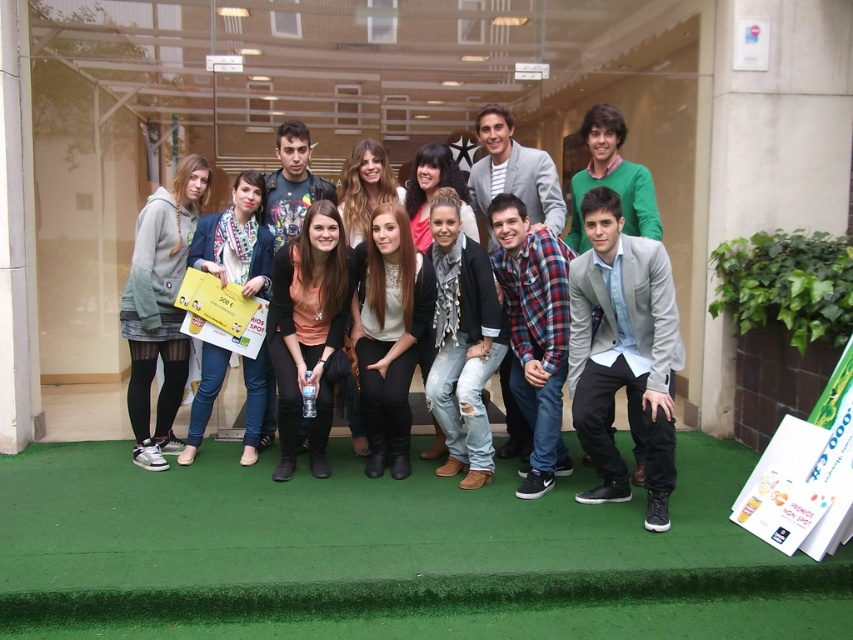
Does ripped denim jeans at center have a lesser height compared to denim jacket at center?

No.

Measure the distance from ripped denim jeans at center to denim jacket at center.

ripped denim jeans at center is 1.32 meters from denim jacket at center.

Between point (451, 282) and point (212, 227), which one is positioned in front?

Point (451, 282)

The image size is (853, 640). What are the coordinates of `ripped denim jeans at center` in the screenshot? It's located at (462, 344).

Does matte black jacket at center appear on the right side of matte gray hoodie at left?

Yes, matte black jacket at center is to the right of matte gray hoodie at left.

Does matte black jacket at center lie in front of matte gray hoodie at left?

Yes, it is in front of matte gray hoodie at left.

Find the location of `matte black jacket at center`. matte black jacket at center is located at coordinates (308, 330).

Which is in front, point (143, 209) or point (373, 362)?

Point (373, 362) is more forward.

Is matte gray hoodie at left below white matte shirt at center?

No, matte gray hoodie at left is not below white matte shirt at center.

In order to click on matte gray hoodie at left in this screenshot , I will do `click(160, 308)`.

Locate an element on the screen. This screenshot has width=853, height=640. matte gray hoodie at left is located at coordinates (160, 308).